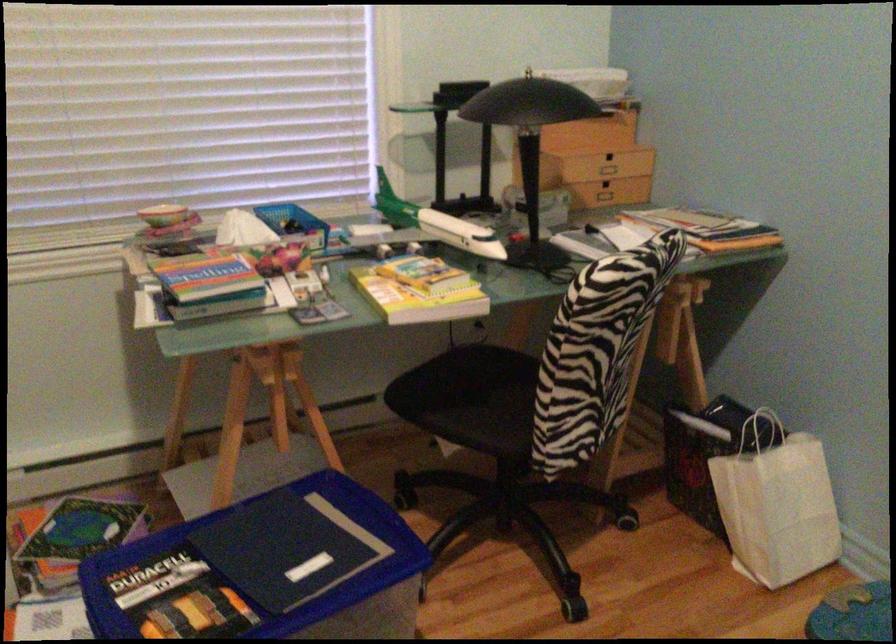
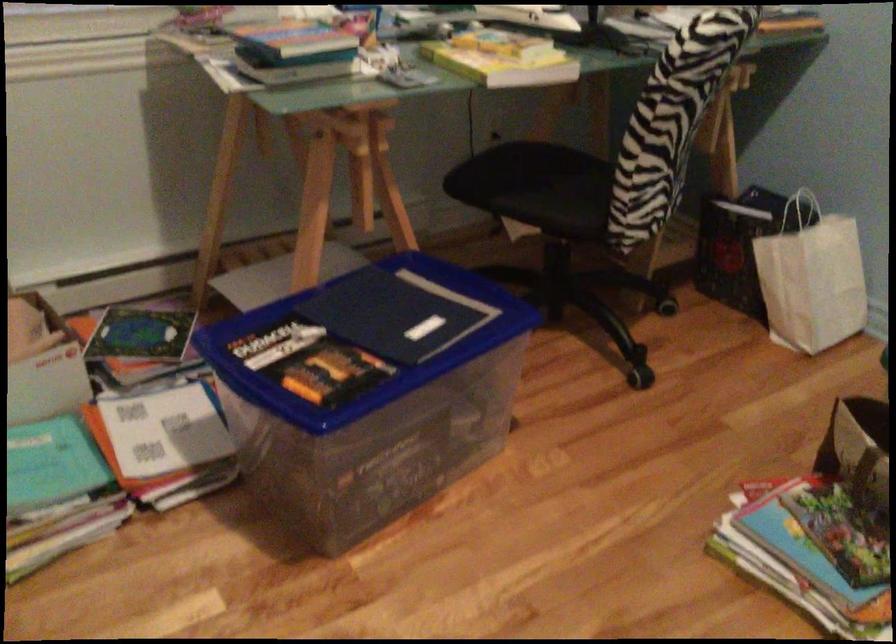
Question: The images are taken continuously from a first-person perspective. In which direction are you moving?

Choices:
 (A) Left
 (B) Right
 (C) Forward
 (D) Backward

Answer: (A)